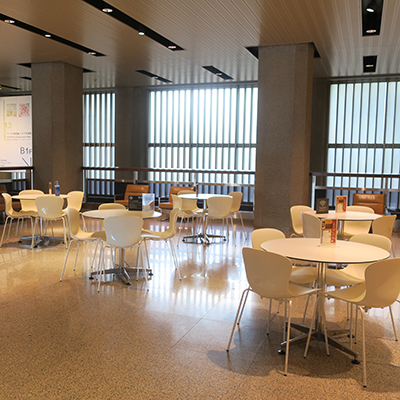
Locate an element on the screen. This screenshot has width=400, height=400. tables is located at coordinates (33, 196), (103, 210), (202, 196), (349, 213), (338, 255).